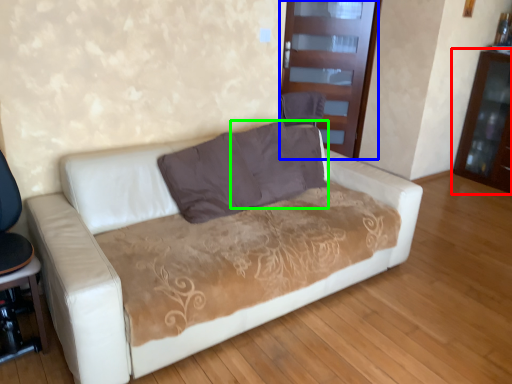
Question: Considering the real-world distances, which object is farthest from dresser (highlighted by a red box)? glass door (highlighted by a blue box) or pillow (highlighted by a green box)?

Choices:
 (A) glass door
 (B) pillow

Answer: (B)